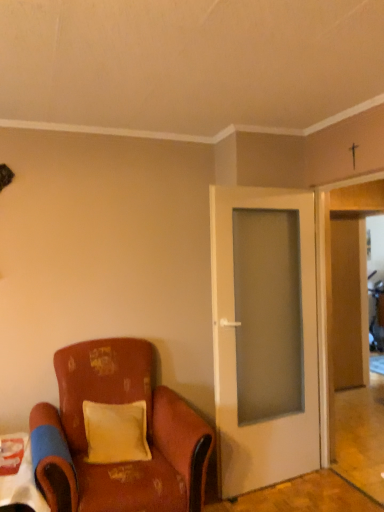
Question: From the image's perspective, relative to white glossy table at lower left, is white glass door at center above or below?

Choices:
 (A) below
 (B) above

Answer: (B)

Question: Based on their positions, is white glass door at center located to the left or right of white glossy table at lower left?

Choices:
 (A) right
 (B) left

Answer: (A)

Question: Which object is positioned farthest from the wooden door at right?

Choices:
 (A) white glass door at center
 (B) white glossy table at lower left
 (C) distressed leather chair at lower left
 (D) yellow velvet pillow at center

Answer: (B)

Question: Which is nearer to the distressed leather chair at lower left?

Choices:
 (A) wooden door at right
 (B) white glass door at center
 (C) yellow velvet pillow at center
 (D) white glossy table at lower left

Answer: (C)